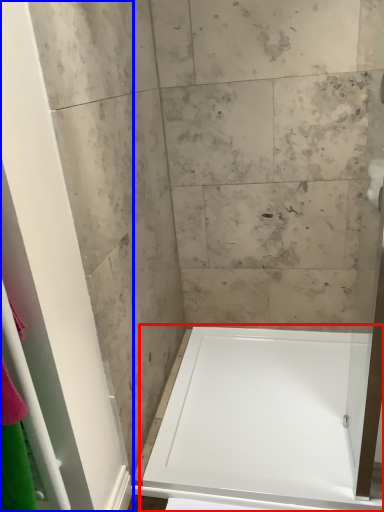
Question: Which object appears farthest to the camera in this image, bathtub (highlighted by a red box) or screen door (highlighted by a blue box)?

Choices:
 (A) bathtub
 (B) screen door

Answer: (A)